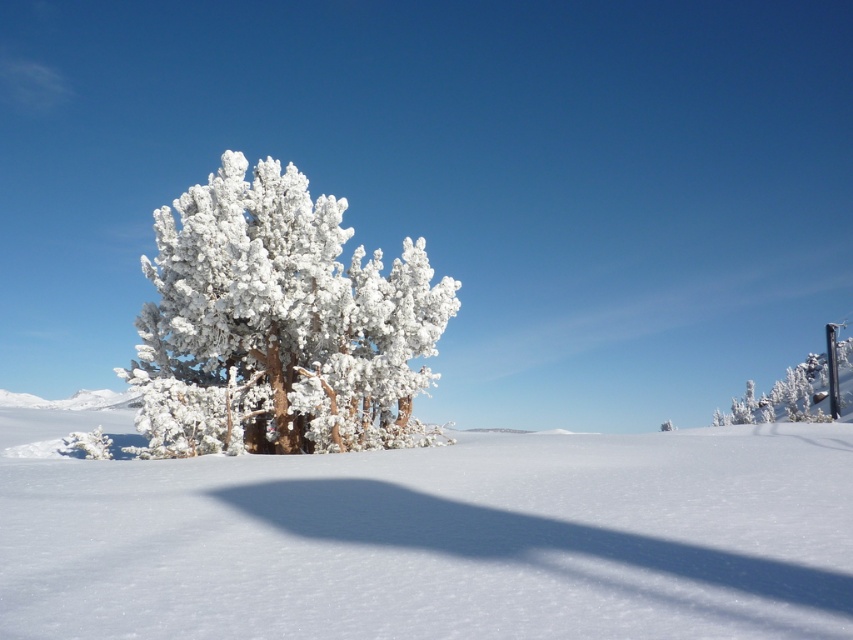
Question: Which object is closer to the camera taking this photo?

Choices:
 (A) frosted white tree at center
 (B) white frosty tree at center
 (C) white frosty tree at upper right

Answer: (B)

Question: Is frosted white tree at center to the left of white frosty tree at upper right from the viewer's perspective?

Choices:
 (A) yes
 (B) no

Answer: (A)

Question: Is white frosty tree at center below white frosty tree at upper right?

Choices:
 (A) no
 (B) yes

Answer: (A)

Question: Which point appears farthest from the camera in this image?

Choices:
 (A) (21, 513)
 (B) (827, 337)

Answer: (B)

Question: Is frosted white tree at center smaller than white frosty tree at upper right?

Choices:
 (A) yes
 (B) no

Answer: (A)

Question: Considering the real-world distances, which object is closest to the frosted white tree at center?

Choices:
 (A) white frosty tree at upper right
 (B) white frosty tree at center

Answer: (B)